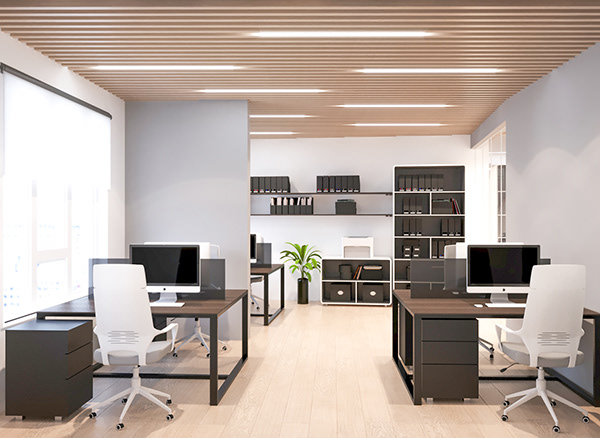
Identify the location of overhead light. click(x=381, y=31), click(x=400, y=67), click(x=263, y=87), click(x=180, y=66), click(x=290, y=115), click(x=386, y=105), click(x=386, y=125), click(x=269, y=132).